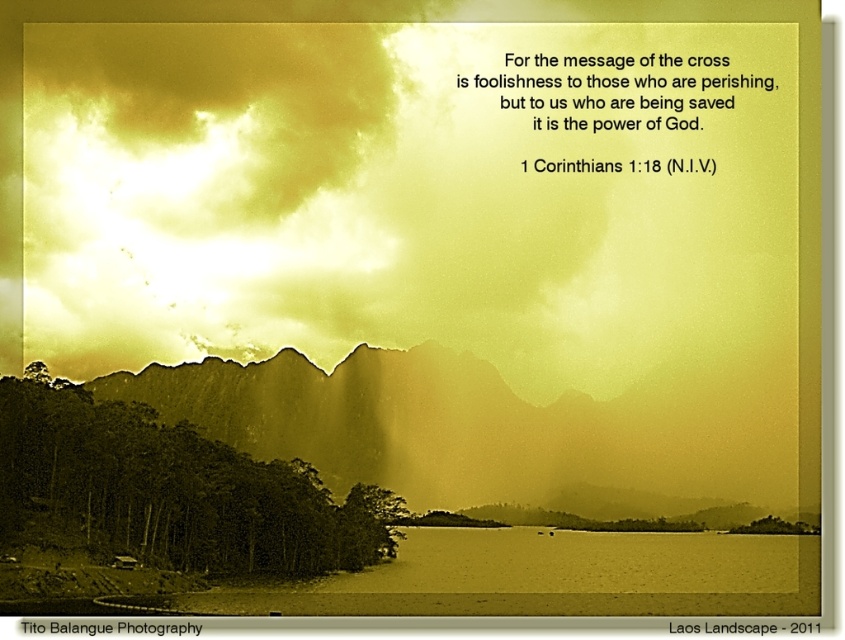
Is golden textured sky at upper center positioned at the back of green matte trees at lower left?

Yes, golden textured sky at upper center is behind green matte trees at lower left.

Measure the distance between golden textured sky at upper center and camera.

golden textured sky at upper center is 568.75 meters away from camera.

Between point (319, 216) and point (37, 380), which one is positioned behind?

The point (319, 216) is more distant.

Where is `golden textured sky at upper center`? golden textured sky at upper center is located at coordinates (309, 195).

Which of these two, golden textured sky at upper center or sepia textured mountain at center, stands taller?

golden textured sky at upper center

Which is in front, point (285, 58) or point (519, 460)?

Point (519, 460) is more forward.

The image size is (845, 640). Identify the location of golden textured sky at upper center. (309, 195).

Does sepia textured mountain at center appear over green matte trees at lower left?

No.

Between sepia textured mountain at center and green matte trees at lower left, which one has less height?

With less height is green matte trees at lower left.

Is point (662, 461) closer to camera compared to point (151, 448)?

No, (662, 461) is further to viewer.

Identify the location of sepia textured mountain at center. This screenshot has width=845, height=640. 491,432.